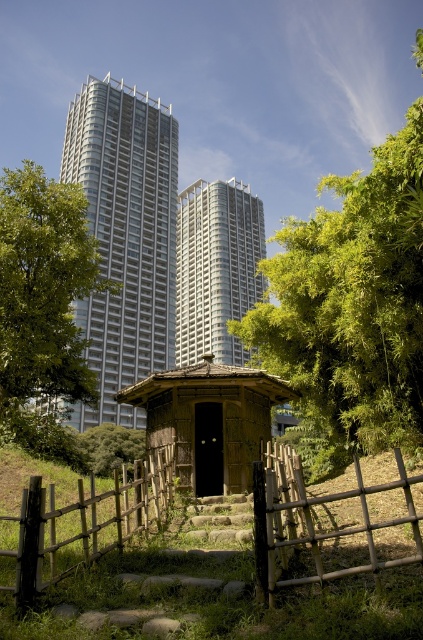
You are a landscape architect designing a walking path between the wooden rustic gate at center and the green leafy tree at left. The path must be exactly 9 meters long. Can you fit the path between them without bending it?

The wooden rustic gate at center and green leafy tree at left are 8.78 meters apart, so a 9 meter path can be placed between them with a slight bend to accommodate the distance.